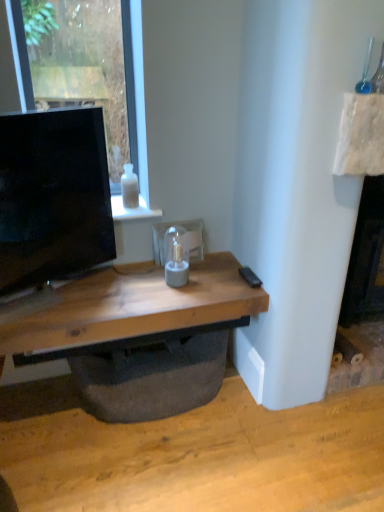
Question: Would you say matte black tv at left contains white glass bottle at upper center?

Choices:
 (A) no
 (B) yes

Answer: (A)

Question: Does matte black tv at left have a greater width compared to white glass bottle at upper center?

Choices:
 (A) yes
 (B) no

Answer: (B)

Question: Is matte black tv at left not within white glass bottle at upper center?

Choices:
 (A) yes
 (B) no

Answer: (A)

Question: Is matte black tv at left smaller than white glass bottle at upper center?

Choices:
 (A) yes
 (B) no

Answer: (B)

Question: Is matte black tv at left oriented away from white glass bottle at upper center?

Choices:
 (A) yes
 (B) no

Answer: (B)

Question: Does point (140, 82) appear closer or farther from the camera than point (135, 183)?

Choices:
 (A) closer
 (B) farther

Answer: (A)

Question: Is transparent glass window at upper left in front of or behind transparent glass bottle at upper center in the image?

Choices:
 (A) behind
 (B) front

Answer: (B)

Question: In terms of height, does transparent glass window at upper left look taller or shorter compared to transparent glass bottle at upper center?

Choices:
 (A) tall
 (B) short

Answer: (A)

Question: Considering the positions of transparent glass window at upper left and transparent glass bottle at upper center in the image, is transparent glass window at upper left bigger or smaller than transparent glass bottle at upper center?

Choices:
 (A) big
 (B) small

Answer: (A)

Question: From a real-world perspective, is black plastic remote at lower right above or below transparent glass bottle at upper center?

Choices:
 (A) below
 (B) above

Answer: (A)

Question: Is black plastic remote at lower right spatially inside transparent glass bottle at upper center, or outside of it?

Choices:
 (A) inside
 (B) outside

Answer: (B)

Question: Looking at their shapes, would you say black plastic remote at lower right is wider or thinner than transparent glass bottle at upper center?

Choices:
 (A) thin
 (B) wide

Answer: (B)

Question: Considering the positions of point (251, 285) and point (130, 162), is point (251, 285) closer or farther from the camera than point (130, 162)?

Choices:
 (A) closer
 (B) farther

Answer: (A)

Question: From a real-world perspective, is matte black tv at left above or below transparent glass bottle at upper center?

Choices:
 (A) below
 (B) above

Answer: (B)

Question: From the image's perspective, is matte black tv at left positioned above or below transparent glass bottle at upper center?

Choices:
 (A) below
 (B) above

Answer: (A)